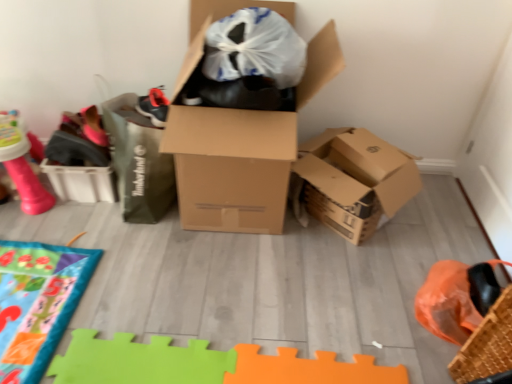
Question: Can you confirm if pink rubber toy at upper left is bigger than brown cardboard box at center?

Choices:
 (A) yes
 (B) no

Answer: (B)

Question: Is pink rubber toy at upper left behind brown cardboard box at center?

Choices:
 (A) no
 (B) yes

Answer: (B)

Question: Is pink rubber toy at upper left facing away from brown cardboard box at center?

Choices:
 (A) yes
 (B) no

Answer: (B)

Question: Does pink rubber toy at upper left appear on the right side of brown cardboard box at center?

Choices:
 (A) yes
 (B) no

Answer: (B)

Question: Can you confirm if pink rubber toy at upper left is taller than brown cardboard box at center?

Choices:
 (A) yes
 (B) no

Answer: (B)

Question: Is point (482, 382) positioned closer to the camera than point (31, 188)?

Choices:
 (A) closer
 (B) farther

Answer: (A)

Question: In the image, is woven brown basket at lower right on the left side or the right side of pink rubber toy at upper left?

Choices:
 (A) left
 (B) right

Answer: (B)

Question: From a real-world perspective, is woven brown basket at lower right physically located above or below pink rubber toy at upper left?

Choices:
 (A) below
 (B) above

Answer: (B)

Question: Is woven brown basket at lower right wider or thinner than pink rubber toy at upper left?

Choices:
 (A) wide
 (B) thin

Answer: (B)

Question: From the image's perspective, is brown cardboard box at center positioned above or below woven brown basket at lower right?

Choices:
 (A) above
 (B) below

Answer: (A)

Question: Is brown cardboard box at center in front of or behind woven brown basket at lower right in the image?

Choices:
 (A) behind
 (B) front

Answer: (A)

Question: In terms of height, does brown cardboard box at center look taller or shorter compared to woven brown basket at lower right?

Choices:
 (A) tall
 (B) short

Answer: (A)

Question: In terms of width, does brown cardboard box at center look wider or thinner when compared to woven brown basket at lower right?

Choices:
 (A) wide
 (B) thin

Answer: (A)

Question: Is woven brown basket at lower right to the left or to the right of brown cardboard box at center in the image?

Choices:
 (A) right
 (B) left

Answer: (A)

Question: Is woven brown basket at lower right wider or thinner than brown cardboard box at center?

Choices:
 (A) thin
 (B) wide

Answer: (A)